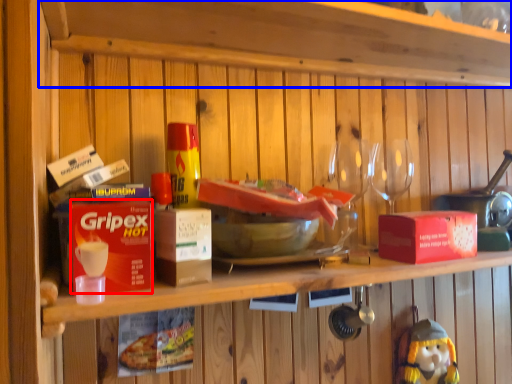
Question: Which object is closer to the camera taking this photo, box (highlighted by a red box) or shelf (highlighted by a blue box)?

Choices:
 (A) box
 (B) shelf

Answer: (B)